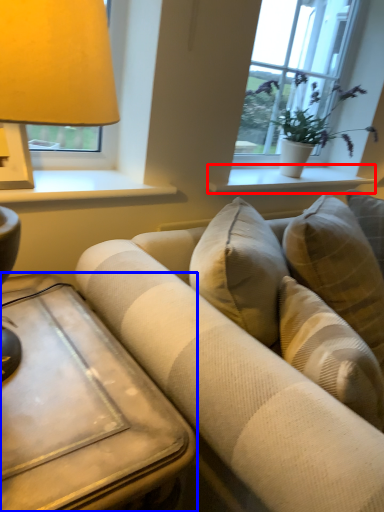
Question: Among these objects, which one is nearest to the camera, window sill (highlighted by a red box) or table (highlighted by a blue box)?

Choices:
 (A) window sill
 (B) table

Answer: (B)